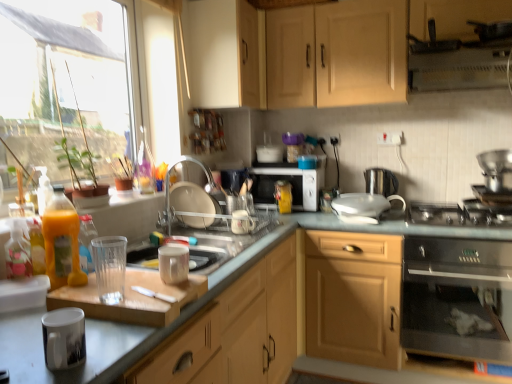
Question: Is matte wood cabinet at center, which is counted as the 3th cabinetry, starting from the top, far from translucent plastic bottle at center, the 3th bottle when ordered from front to back?

Choices:
 (A) yes
 (B) no

Answer: (B)

Question: From a real-world perspective, is matte wood cabinet at center, which is counted as the first cabinetry, starting from the bottom, below translucent plastic bottle at center, the 1th bottle when ordered from right to left?

Choices:
 (A) no
 (B) yes

Answer: (B)

Question: Considering the relative sizes of matte wood cabinet at center, which is counted as the first cabinetry, starting from the bottom, and translucent plastic bottle at center, which is counted as the third bottle, starting from the left, in the image provided, is matte wood cabinet at center, which is counted as the first cabinetry, starting from the bottom, shorter than translucent plastic bottle at center, which is counted as the third bottle, starting from the left,?

Choices:
 (A) no
 (B) yes

Answer: (A)

Question: Is matte wood cabinet at center, which is counted as the first cabinetry, starting from the bottom, positioned with its back to translucent plastic bottle at center, the 1th bottle viewed from the back?

Choices:
 (A) yes
 (B) no

Answer: (B)

Question: Is matte wood cabinet at center, which is counted as the first cabinetry, starting from the bottom, positioned in front of translucent plastic bottle at center, the 1th bottle viewed from the back?

Choices:
 (A) no
 (B) yes

Answer: (B)

Question: From a real-world perspective, is white glossy kettle at center, acting as the 2th appliance starting from the back, physically located above or below stainless steel oven at lower right?

Choices:
 (A) below
 (B) above

Answer: (B)

Question: Is white glossy kettle at center, arranged as the 6th appliance when viewed from the left, to the left or to the right of stainless steel oven at lower right in the image?

Choices:
 (A) left
 (B) right

Answer: (A)

Question: Considering the positions of white glossy kettle at center, arranged as the 6th appliance when viewed from the left, and stainless steel oven at lower right in the image, is white glossy kettle at center, arranged as the 6th appliance when viewed from the left, wider or thinner than stainless steel oven at lower right?

Choices:
 (A) wide
 (B) thin

Answer: (B)

Question: Does point (367, 208) appear closer or farther from the camera than point (459, 309)?

Choices:
 (A) closer
 (B) farther

Answer: (B)

Question: In the image, is translucent plastic bottle at left, which is the second bottle in right-to-left order, on the left side or the right side of white glossy faucet at center?

Choices:
 (A) right
 (B) left

Answer: (B)

Question: From the image's perspective, is translucent plastic bottle at left, arranged as the 2th bottle when viewed from the left, located above or below white glossy faucet at center?

Choices:
 (A) above
 (B) below

Answer: (B)

Question: Considering the positions of translucent plastic bottle at left, which is the second bottle in right-to-left order, and white glossy faucet at center in the image, is translucent plastic bottle at left, which is the second bottle in right-to-left order, bigger or smaller than white glossy faucet at center?

Choices:
 (A) big
 (B) small

Answer: (B)

Question: From a real-world perspective, relative to white glossy faucet at center, is translucent plastic bottle at left, placed as the 2th bottle when sorted from front to back, vertically above or below?

Choices:
 (A) above
 (B) below

Answer: (B)

Question: Looking at their shapes, would you say transparent glass window at left is wider or thinner than glossy ceramic mug at lower left, placed as the eighth appliance when sorted from back to front?

Choices:
 (A) thin
 (B) wide

Answer: (A)

Question: Considering the positions of transparent glass window at left and glossy ceramic mug at lower left, which is the first appliance in left-to-right order, in the image, is transparent glass window at left bigger or smaller than glossy ceramic mug at lower left, which is the first appliance in left-to-right order,?

Choices:
 (A) big
 (B) small

Answer: (A)